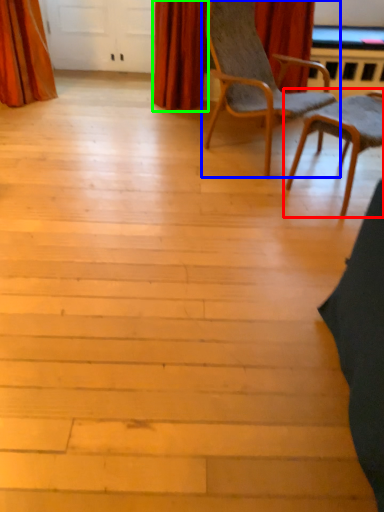
Question: Based on their relative distances, which object is nearer to chair (highlighted by a red box)? Choose from chair (highlighted by a blue box) and curtain (highlighted by a green box).

Choices:
 (A) chair
 (B) curtain

Answer: (A)